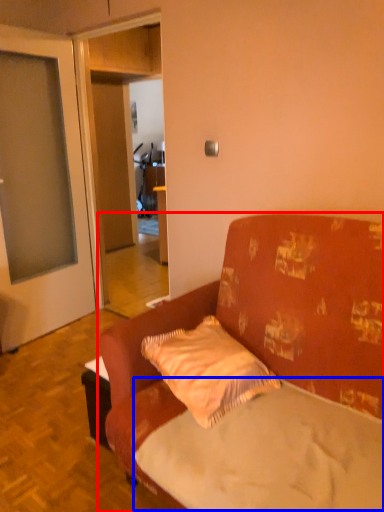
Question: Which object is closer to the camera taking this photo, studio couch (highlighted by a red box) or mattress (highlighted by a blue box)?

Choices:
 (A) studio couch
 (B) mattress

Answer: (A)